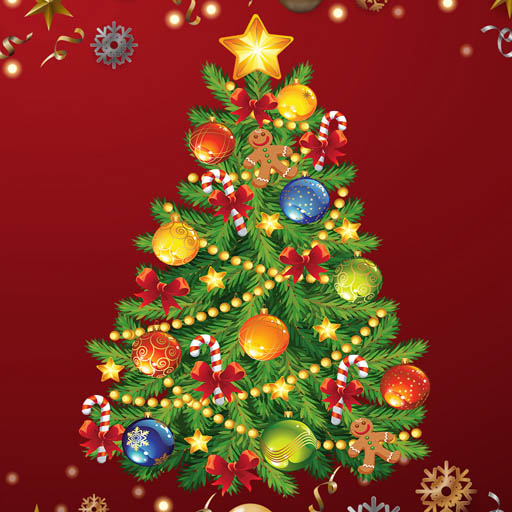
You are a GUI agent. You are given a task and a screenshot of the screen. Output one action in this format:
    pyautogui.click(x=<x>, y=<y>)
    Task: Click on the chirstmas tree
    This screenshot has width=512, height=512.
    Given the screenshot: What is the action you would take?
    pyautogui.click(x=249, y=375)